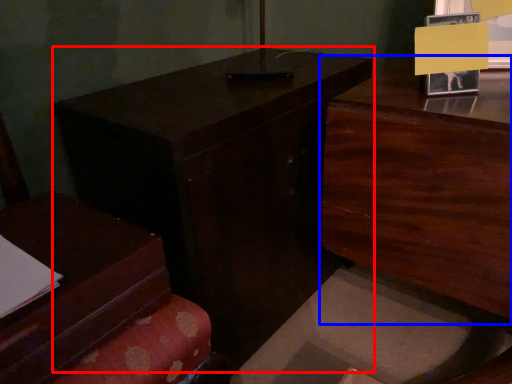
Question: Which object is closer to the camera taking this photo, table (highlighted by a red box) or dresser (highlighted by a blue box)?

Choices:
 (A) table
 (B) dresser

Answer: (B)